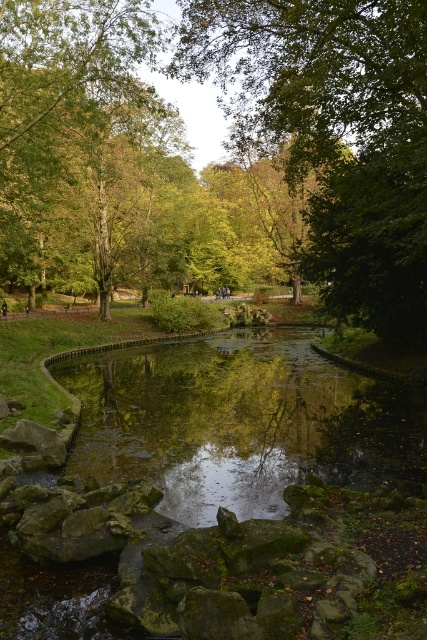
Question: Which point appears farthest from the camera in this image?

Choices:
 (A) (2, 314)
 (B) (204, 349)
 (C) (348, 212)
 (D) (108, 92)

Answer: (A)

Question: Does green reflective water at center appear under dark brown leather jacket at center?

Choices:
 (A) yes
 (B) no

Answer: (A)

Question: Which object appears farthest from the camera in this image?

Choices:
 (A) green reflective water at center
 (B) green leafy tree at upper left
 (C) dark brown leather jacket at center

Answer: (C)

Question: Among these points, which one is nearest to the camera?

Choices:
 (A) (3, 317)
 (B) (263, 385)
 (C) (313, 76)
 (D) (23, 67)

Answer: (C)

Question: Does green leafy tree at center have a larger size compared to green reflective water at center?

Choices:
 (A) yes
 (B) no

Answer: (A)

Question: Where is green reflective water at center located in relation to dark brown leather jacket at center in the image?

Choices:
 (A) right
 (B) left

Answer: (A)